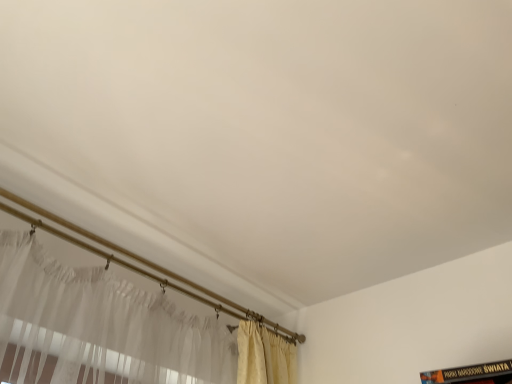
Question: Can you confirm if white sheer curtain at lower left is thinner than black matte book at lower right?

Choices:
 (A) no
 (B) yes

Answer: (B)

Question: Is white sheer curtain at lower left taller than black matte book at lower right?

Choices:
 (A) yes
 (B) no

Answer: (B)

Question: Does white sheer curtain at lower left lie in front of black matte book at lower right?

Choices:
 (A) no
 (B) yes

Answer: (A)

Question: Are white sheer curtain at lower left and black matte book at lower right far apart?

Choices:
 (A) yes
 (B) no

Answer: (B)

Question: Considering the relative sizes of white sheer curtain at lower left and black matte book at lower right in the image provided, is white sheer curtain at lower left smaller than black matte book at lower right?

Choices:
 (A) yes
 (B) no

Answer: (B)

Question: Is white sheer curtain at lower left positioned beyond the bounds of black matte book at lower right?

Choices:
 (A) yes
 (B) no

Answer: (A)

Question: Is black matte book at lower right to the left of white sheer curtain at lower left from the viewer's perspective?

Choices:
 (A) no
 (B) yes

Answer: (A)

Question: Can you confirm if black matte book at lower right is wider than white sheer curtain at lower left?

Choices:
 (A) no
 (B) yes

Answer: (B)

Question: Can you confirm if black matte book at lower right is taller than white sheer curtain at lower left?

Choices:
 (A) no
 (B) yes

Answer: (B)

Question: Is black matte book at lower right bigger than white sheer curtain at lower left?

Choices:
 (A) yes
 (B) no

Answer: (B)

Question: Can you confirm if black matte book at lower right is smaller than white sheer curtain at lower left?

Choices:
 (A) no
 (B) yes

Answer: (B)

Question: Is black matte book at lower right closer to the viewer compared to white sheer curtain at lower left?

Choices:
 (A) no
 (B) yes

Answer: (B)

Question: Is white sheer curtain at lower left bigger or smaller than black matte book at lower right?

Choices:
 (A) small
 (B) big

Answer: (B)